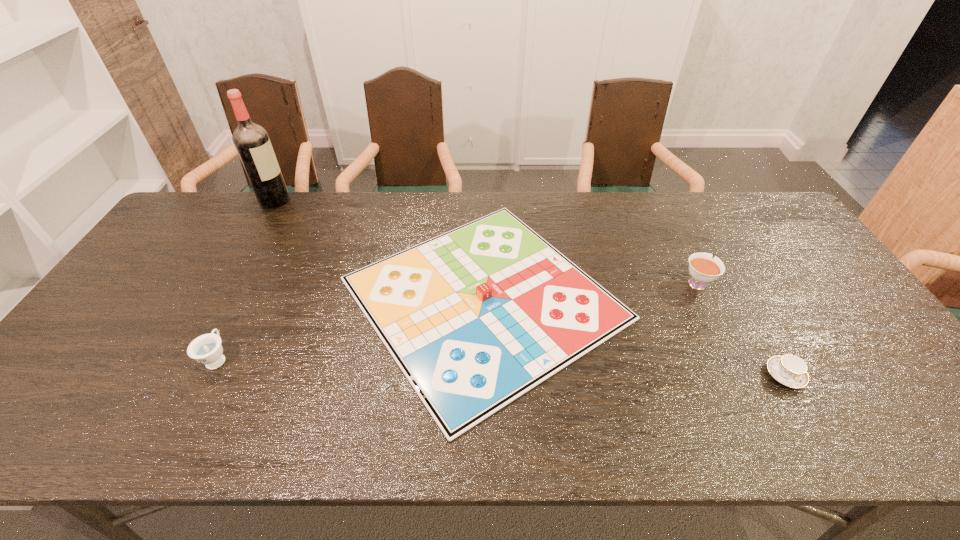
Locate an element on the screen. the farthest object is located at coordinates (251, 141).

The height and width of the screenshot is (540, 960). Find the location of `liquor`. liquor is located at coordinates (251, 141).

Where is `the farthest teacup`? The image size is (960, 540). the farthest teacup is located at coordinates click(x=703, y=269).

Locate an element on the screen. the fourth shortest object is located at coordinates (703, 269).

What are the coordinates of `the second shortest teacup` in the screenshot? It's located at (206, 349).

You are a GUI agent. You are given a task and a screenshot of the screen. Output one action in this format:
    pyautogui.click(x=<x>, y=<y>)
    Task: Click on the leftmost teacup
    This screenshot has height=540, width=960.
    Given the screenshot: What is the action you would take?
    pyautogui.click(x=206, y=349)

The image size is (960, 540). I want to click on the rightmost teacup, so click(x=789, y=370).

Where is `the shortest teacup`? the shortest teacup is located at coordinates (789, 370).

Locate an element on the screen. the third object from right to left is located at coordinates (475, 317).

Identify the location of vacant space situated 0.220m on the front-facing side of the tallest object. (351, 200).